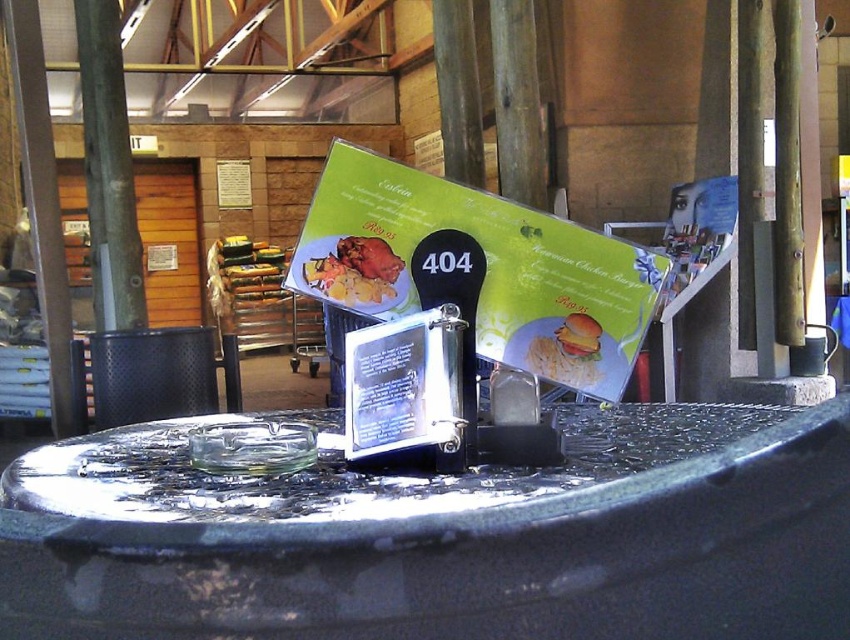
Question: Is matte brown crab at center positioned in front of golden crispy hamburger at center?

Choices:
 (A) yes
 (B) no

Answer: (B)

Question: Which point appears closest to the camera in this image?

Choices:
 (A) (360, 296)
 (B) (588, 385)
 (C) (128, 170)
 (D) (262, 269)

Answer: (B)

Question: Considering the relative positions of metallic pole at center and golden fried chicken at center in the image provided, where is metallic pole at center located with respect to golden fried chicken at center?

Choices:
 (A) right
 (B) left

Answer: (A)

Question: Is golden fried chicken at center thinner than golden crispy hamburger at center?

Choices:
 (A) no
 (B) yes

Answer: (A)

Question: Which point is farther from the camera taking this photo?

Choices:
 (A) (304, 268)
 (B) (241, 275)
 (C) (140, 301)
 (D) (840, 534)

Answer: (B)

Question: Which object is closer to the camera taking this photo?

Choices:
 (A) metallic pole at center
 (B) golden crispy hamburger at center
 (C) matte brown crab at center

Answer: (B)